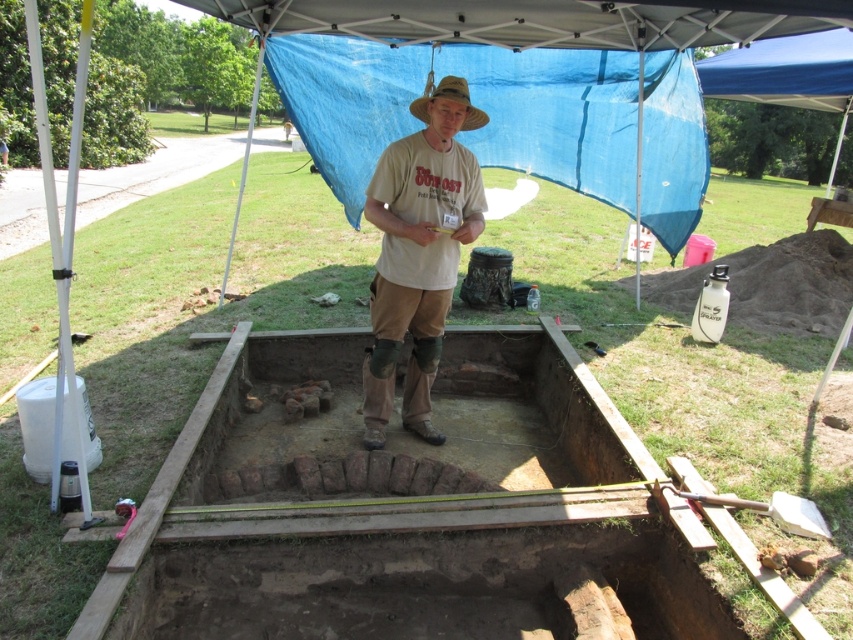
You are an archaeologist at the excavation site. You notice the brown clay foundation at center and the brown straw hat at center. Which object is positioned lower in the scene?

The brown clay foundation at center is located below the brown straw hat at center, so it is positioned lower in the scene.

You are an archaeologist at the excavation site. You need to retrieve the brown straw hat at center without stepping outside the trench. Can you reach it from your current position near the brown clay foundation at center?

The brown clay foundation at center is in front of the brown straw hat at center, so the brown straw hat at center is behind the foundation. Since you are near the foundation, you cannot reach the hat without moving around the foundation or stepping outside the trench.

You are an archaeologist at the excavation site. You need to place a 1.5 meter wide protective cover over the beige cotton shirt at center and the brown clay foundation at center. Which object requires a larger cover based on their widths?

The brown clay foundation at center requires a larger cover because its width surpasses that of the beige cotton shirt at center.